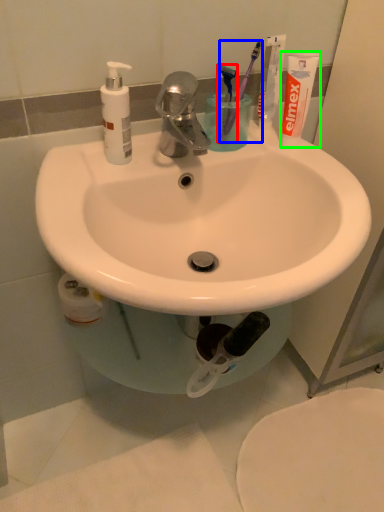
Question: Which object is the farthest from toothbrush (highlighted by a red box)? Choose among these: toothbrush (highlighted by a blue box) or toothpaste (highlighted by a green box).

Choices:
 (A) toothbrush
 (B) toothpaste

Answer: (B)